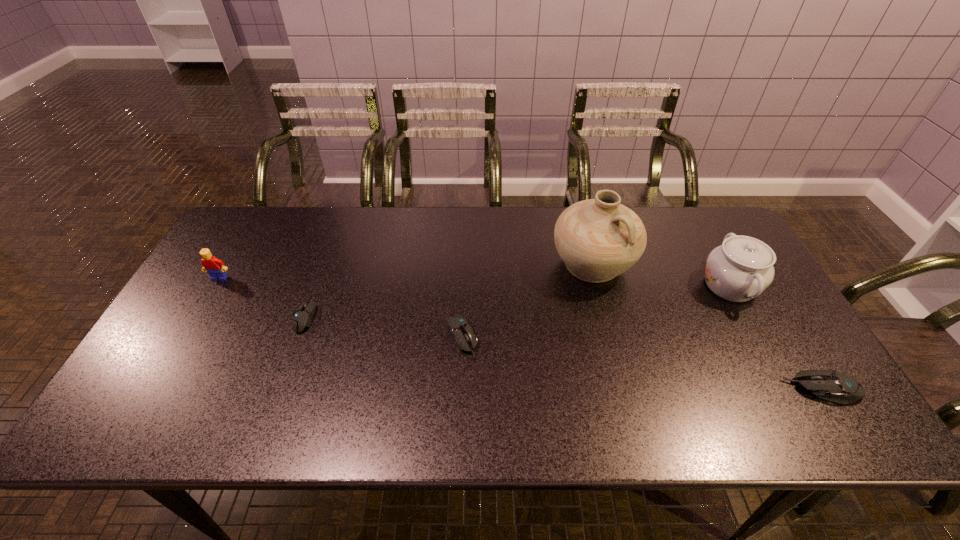
The height and width of the screenshot is (540, 960). What are the coordinates of `the third object from right to left` in the screenshot? It's located at (598, 239).

The image size is (960, 540). I want to click on vacant space situated on the back of the shortest object, so click(x=327, y=256).

Locate an element on the screen. The image size is (960, 540). vacant point located 0.190m on the back of the second shortest computer mouse is located at coordinates (465, 269).

This screenshot has width=960, height=540. I want to click on vacant space located on the back of the rightmost computer mouse, so click(x=753, y=275).

The width and height of the screenshot is (960, 540). Identify the location of free space located 0.390m on the left of the chinaware. (565, 286).

Locate an element on the screen. free location located 0.310m on the face of the leftmost object is located at coordinates (164, 372).

This screenshot has height=540, width=960. I want to click on blank space located 0.150m on the right of the fourth object from left to right, so [x=684, y=265].

Identify the location of object present at the far edge. [x=598, y=239].

Locate an element on the screen. This screenshot has width=960, height=540. object situated at the near edge is located at coordinates (830, 385).

You are a GUI agent. You are given a task and a screenshot of the screen. Output one action in this format:
    pyautogui.click(x=<x>, y=<y>)
    Task: Click on the object that is at the left edge
    
    Given the screenshot: What is the action you would take?
    pyautogui.click(x=212, y=265)